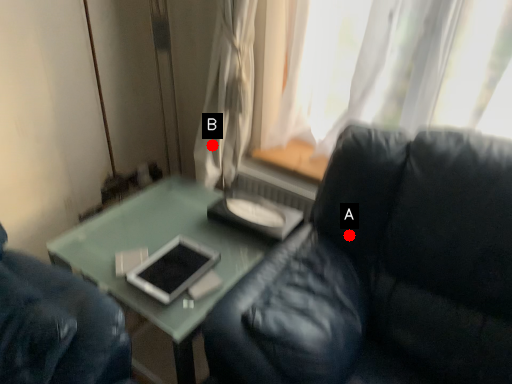
Question: Two points are circled on the image, labeled by A and B beside each circle. Among these points, which one is farthest from the camera?

Choices:
 (A) A is further
 (B) B is further

Answer: (B)